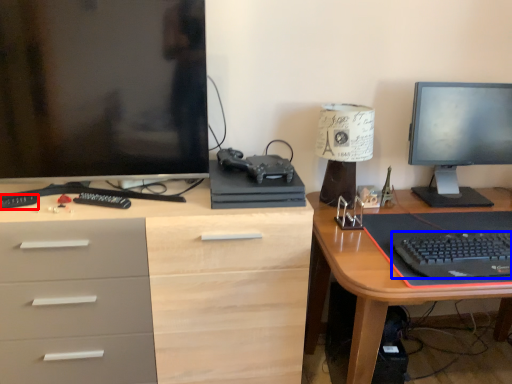
Question: Which point is further to the camera, remote control (highlighted by a red box) or computer keyboard (highlighted by a blue box)?

Choices:
 (A) remote control
 (B) computer keyboard

Answer: (A)